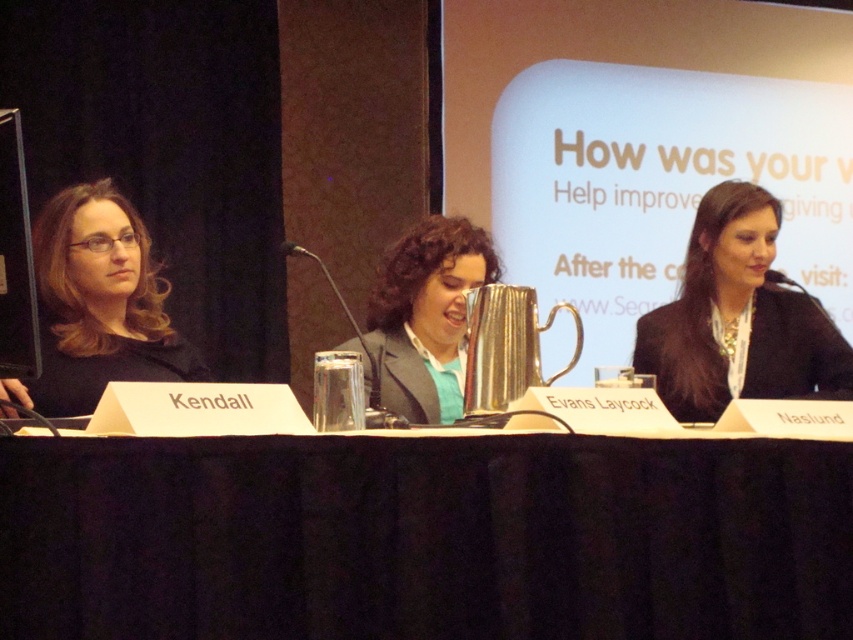
Does black silk blazer at right have a greater height compared to metallic silver pitcher at center?

Correct, black silk blazer at right is much taller as metallic silver pitcher at center.

Does black silk blazer at right lie behind metallic silver pitcher at center?

That is True.

Who is more distant from viewer, (x=759, y=257) or (x=428, y=371)?

Positioned behind is point (x=759, y=257).

Locate an element on the screen. This screenshot has height=640, width=853. black silk blazer at right is located at coordinates (740, 317).

Is black fabric table at center smaller than metallic silver pitcher at center?

Yes.

Which is in front, point (138, 573) or point (434, 412)?

Point (138, 573)

Locate an element on the screen. black fabric table at center is located at coordinates (424, 538).

Who is shorter, black fabric table at center or matte black jacket at left?

black fabric table at center is shorter.

Between point (93, 552) and point (73, 193), which one is positioned behind?

Positioned behind is point (73, 193).

Which is behind, point (776, 630) or point (86, 310)?

Point (86, 310)

In order to click on black fabric table at center in this screenshot , I will do `click(424, 538)`.